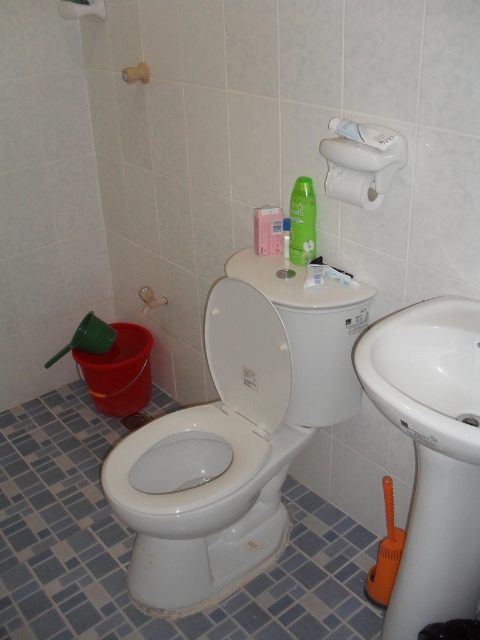
You are trying to locate two specific points in the bathroom scene. Which of the two points, point (417, 440) or point (309, 253), is nearer to you as you look at the image?

Point (417, 440) is closer to the viewer than point (309, 253).

You are a home inspector checking the bathroom layout. You need to determine if the white glossy sink at lower right blocks the view of the white matte toilet paper at upper right from the toilet area. Based on their positions, what do you observe?

The white glossy sink at lower right is in front of the white matte toilet paper at upper right, so it does block the view of the white matte toilet paper at upper right from the toilet area.

You are a cleaning robot trying to reach the green matte lotion at upper center to clean it. The white glossy toilet lid at center is in your way. Can you move around it to access the lotion?

The white glossy toilet lid at center is closer to the viewer than the green matte lotion at upper center, so you can move around it to access the lotion since it is in front of the lotion.